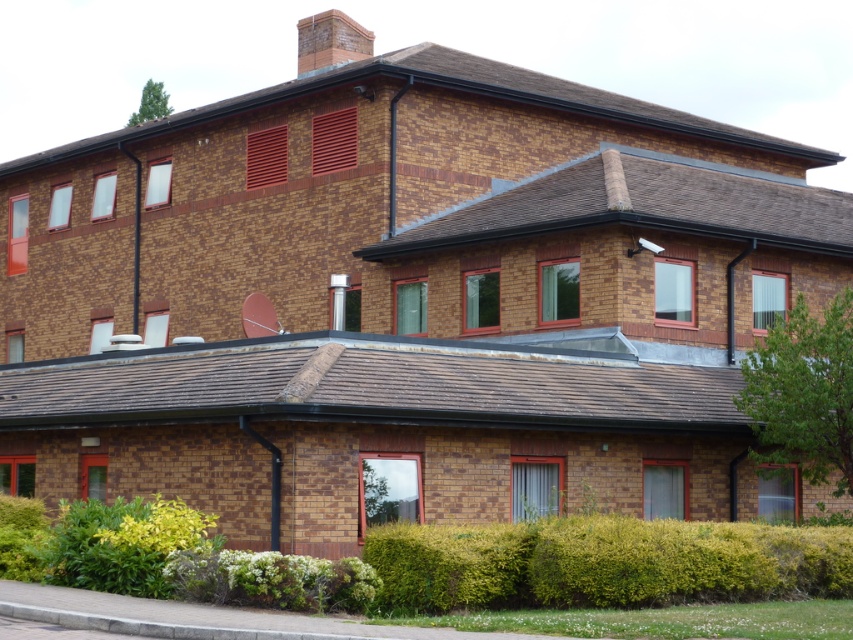
You are a gardener planning to trim the green leafy bush at upper right and the green leafy hedge at lower left. Which of these two plants requires a wider swing of the trimmer to handle its width?

The green leafy hedge at lower left requires a wider swing of the trimmer since it has a greater width than the green leafy bush at upper right.

You are a gardener planning to water the green leafy hedge at lower center and the green leafy bush at upper right. You have a hose that can reach up to 8 meters. Can you water both plants without moving the hose? Please explain your reasoning.

The green leafy hedge at lower center is 7.97 meters from the green leafy bush at upper right. Since the hose can reach up to 8 meters, the distance between them is just under the hose length. Therefore, if the hose is positioned between the two plants, it should be able to reach both without needing to move it.